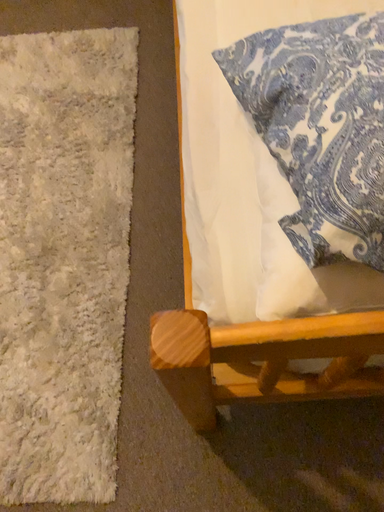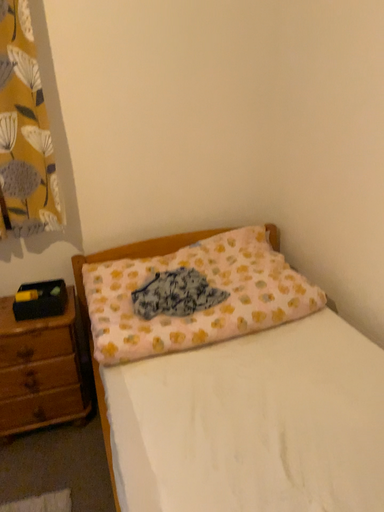
Question: How did the camera likely rotate when shooting the video?

Choices:
 (A) rotated downward
 (B) rotated upward

Answer: (B)